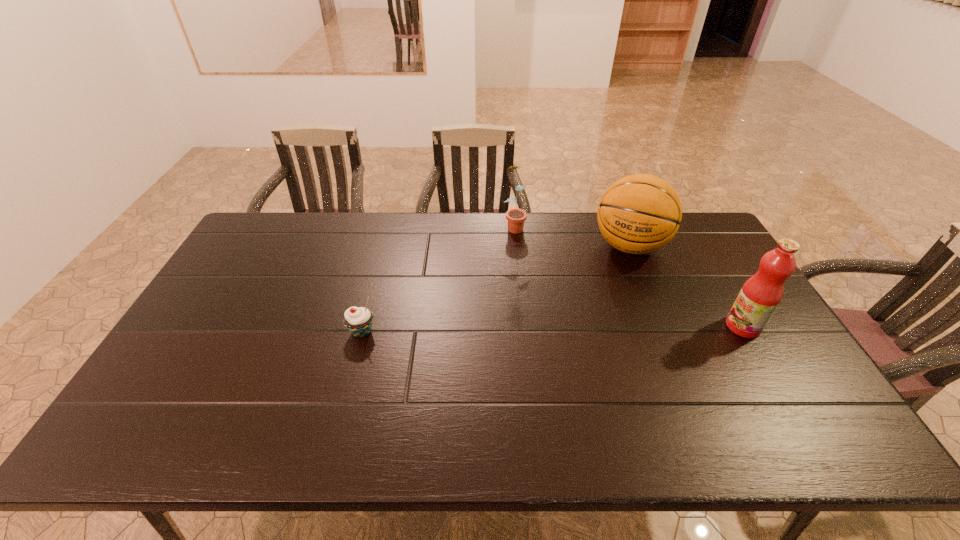
Image resolution: width=960 pixels, height=540 pixels. Find the location of `unoccupied position between the rightmost object and the third object from right to left`. unoccupied position between the rightmost object and the third object from right to left is located at coordinates (628, 276).

What are the coordinates of `free spot between the second object from right to left and the cupcake` in the screenshot? It's located at (495, 289).

You are a GUI agent. You are given a task and a screenshot of the screen. Output one action in this format:
    pyautogui.click(x=<x>, y=<y>)
    Task: Click on the object that is the third closest one to the third object from right to left
    
    Given the screenshot: What is the action you would take?
    pyautogui.click(x=760, y=295)

Identify which object is the second closest to the second object from left to right. Please provide its 2D coordinates. Your answer should be formatted as a tuple, i.e. [(x, y)], where the tuple contains the x and y coordinates of a point satisfying the conditions above.

[(358, 320)]

This screenshot has height=540, width=960. In order to click on vacant area in the image that satisfies the following two spatial constraints: 1. on the front side of the rightmost object; 2. on the front label of the third object from left to right in this screenshot , I will do [662, 326].

This screenshot has width=960, height=540. I want to click on free space that satisfies the following two spatial constraints: 1. on the back side of the rightmost object; 2. on the front label of the shortest object, so click(363, 326).

Locate an element on the screen. The image size is (960, 540). free space in the image that satisfies the following two spatial constraints: 1. on the front side of the second object from left to right; 2. on the left side of the second object from right to left is located at coordinates (516, 246).